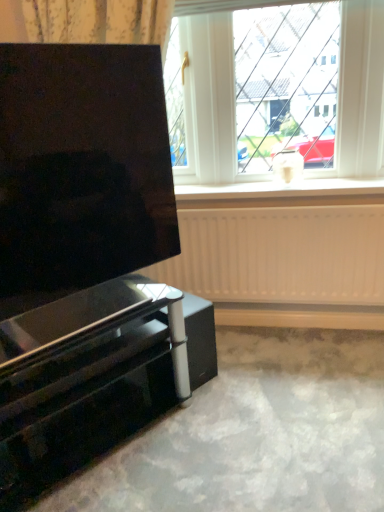
The image size is (384, 512). I want to click on white matte window sill at center, so click(283, 193).

In order to face matte black screen at left, should I rotate leftwards or rightwards?

Turn left approximately 14.597 degrees to face it.

Describe the element at coordinates (96, 379) in the screenshot. I see `glossy black tv stand at lower left` at that location.

What is the approximate height of white matte radiator at lower center?

white matte radiator at lower center is 22.81 inches in height.

At what (x,y) coordinates should I click in order to perform the action: click on white matte window sill at center. Please return your answer as a coordinate pair (x, y). The width and height of the screenshot is (384, 512). Looking at the image, I should click on (283, 193).

Does white matte radiator at lower center appear on the right side of glossy black tv stand at lower left?

Yes.

Locate an element on the screen. This screenshot has height=512, width=384. furniture in front of the white matte radiator at lower center is located at coordinates (96, 379).

Would you say white matte radiator at lower center is a long distance from glossy black tv stand at lower left?

Actually, white matte radiator at lower center and glossy black tv stand at lower left are a little close together.

From the picture: Does white matte radiator at lower center have a greater height compared to glossy black tv stand at lower left?

Correct, white matte radiator at lower center is much taller as glossy black tv stand at lower left.

Does point (184, 200) come behind point (16, 414)?

Yes, it is behind point (16, 414).

Is white matte window sill at center positioned with its back to glossy black tv stand at lower left?

white matte window sill at center does not have its back to glossy black tv stand at lower left.

Is white matte window sill at center situated inside glossy black tv stand at lower left or outside?

white matte window sill at center exists outside the volume of glossy black tv stand at lower left.

Based on the photo, is matte black screen at left looking in the opposite direction of white matte radiator at lower center?

matte black screen at left is not turned away from white matte radiator at lower center.

Considering the sizes of objects matte black screen at left and white matte radiator at lower center in the image provided, who is bigger, matte black screen at left or white matte radiator at lower center?

Bigger between the two is matte black screen at left.

Is matte black screen at left not near white matte radiator at lower center?

No, there isn't a large distance between matte black screen at left and white matte radiator at lower center.

Who is smaller, white matte radiator at lower center or white plastic window at upper center?

white matte radiator at lower center is smaller.

Which object is positioned more to the right, white matte radiator at lower center or white plastic window at upper center?

white matte radiator at lower center is more to the right.

This screenshot has height=512, width=384. Identify the location of window in front of the white matte radiator at lower center. (276, 90).

From a real-world perspective, relative to white plastic window at upper center, is white matte radiator at lower center vertically above or below?

In terms of real-world spatial position, white matte radiator at lower center is below white plastic window at upper center.

Between white matte window sill at center and white plastic window at upper center, which one has smaller size?

Smaller between the two is white matte window sill at center.

Is white matte window sill at center oriented away from white plastic window at upper center?

No, white matte window sill at center is not facing the opposite direction of white plastic window at upper center.

From the image's perspective, is white matte window sill at center located above or below white plastic window at upper center?

white matte window sill at center is below white plastic window at upper center.

Considering the relative sizes of white matte window sill at center and white plastic window at upper center in the image provided, is white matte window sill at center thinner than white plastic window at upper center?

Incorrect, the width of white matte window sill at center is not less than that of white plastic window at upper center.

Considering the relative sizes of white matte window sill at center and matte black screen at left in the image provided, is white matte window sill at center thinner than matte black screen at left?

Incorrect, the width of white matte window sill at center is not less than that of matte black screen at left.

Considering the points (346, 187) and (4, 267), which point is in front, point (346, 187) or point (4, 267)?

The point (4, 267) is more forward.

Which is more to the left, white matte window sill at center or matte black screen at left?

From the viewer's perspective, matte black screen at left appears more on the left side.

From a real-world perspective, between white matte window sill at center and matte black screen at left, who is vertically lower?

In real-world perspective, white matte window sill at center is lower.

In terms of size, does white matte window sill at center appear bigger or smaller than white matte radiator at lower center?

Clearly, white matte window sill at center is smaller in size than white matte radiator at lower center.

Locate an element on the screen. The height and width of the screenshot is (512, 384). window sill that appears on the right of white matte radiator at lower center is located at coordinates [x=283, y=193].

How far apart are white matte window sill at center and white matte radiator at lower center?

The distance of white matte window sill at center from white matte radiator at lower center is 22.04 centimeters.

Relative to white matte radiator at lower center, is white matte window sill at center in front or behind?

Clearly, white matte window sill at center is behind white matte radiator at lower center.

Image resolution: width=384 pixels, height=512 pixels. In order to click on furniture below the white matte radiator at lower center (from a real-world perspective) in this screenshot , I will do `click(96, 379)`.

The image size is (384, 512). Identify the location of furniture lying in front of the white matte window sill at center. (96, 379).

When comparing their distances from glossy black tv stand at lower left, does white plastic window at upper center or matte black screen at left seem closer?

matte black screen at left is positioned closer to the anchor glossy black tv stand at lower left.

In the scene shown: Which object lies further to the anchor point glossy black tv stand at lower left, matte black screen at left or white matte window sill at center?

Based on the image, white matte window sill at center appears to be further to glossy black tv stand at lower left.

From the image, which object appears to be nearer to white matte radiator at lower center, white matte window sill at center or glossy black tv stand at lower left?

Based on the image, white matte window sill at center appears to be nearer to white matte radiator at lower center.

Consider the image. Looking at the image, which one is located closer to white matte radiator at lower center, glossy black tv stand at lower left or white plastic window at upper center?

white plastic window at upper center is positioned closer to the anchor white matte radiator at lower center.

Looking at the image, which one is located closer to glossy black tv stand at lower left, white matte window sill at center or white matte radiator at lower center?

Based on the image, white matte radiator at lower center appears to be nearer to glossy black tv stand at lower left.

When comparing their distances from white matte window sill at center, does white matte radiator at lower center or matte black screen at left seem closer?

white matte radiator at lower center is positioned closer to the anchor white matte window sill at center.

Considering their positions, is white matte radiator at lower center positioned further to glossy black tv stand at lower left than matte black screen at left?

Based on the image, white matte radiator at lower center appears to be further to glossy black tv stand at lower left.

Estimate the real-world distances between objects in this image. Which object is closer to white plastic window at upper center, matte black screen at left or white matte window sill at center?

white matte window sill at center is closer to white plastic window at upper center.

Locate an element on the screen. screen between white plastic window at upper center and glossy black tv stand at lower left vertically is located at coordinates (81, 169).

Locate an element on the screen. The width and height of the screenshot is (384, 512). radiator positioned between matte black screen at left and white matte window sill at center from near to far is located at coordinates click(280, 255).

Where is `radiator between white plastic window at upper center and glossy black tv stand at lower left in the up-down direction`? This screenshot has height=512, width=384. radiator between white plastic window at upper center and glossy black tv stand at lower left in the up-down direction is located at coordinates (280, 255).

At what (x,y) coordinates should I click in order to perform the action: click on radiator between glossy black tv stand at lower left and white matte window sill at center along the z-axis. Please return your answer as a coordinate pair (x, y). Looking at the image, I should click on (280, 255).